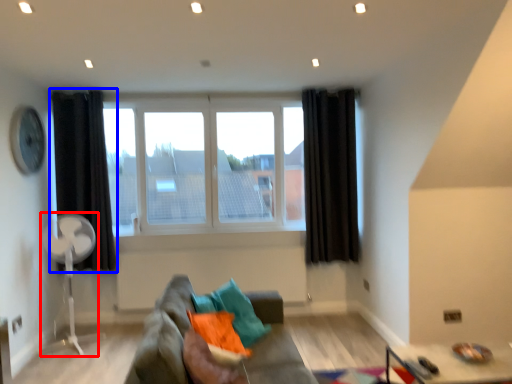
Question: Which of the following is the closest to the observer, fan (highlighted by a red box) or curtain (highlighted by a blue box)?

Choices:
 (A) fan
 (B) curtain

Answer: (A)